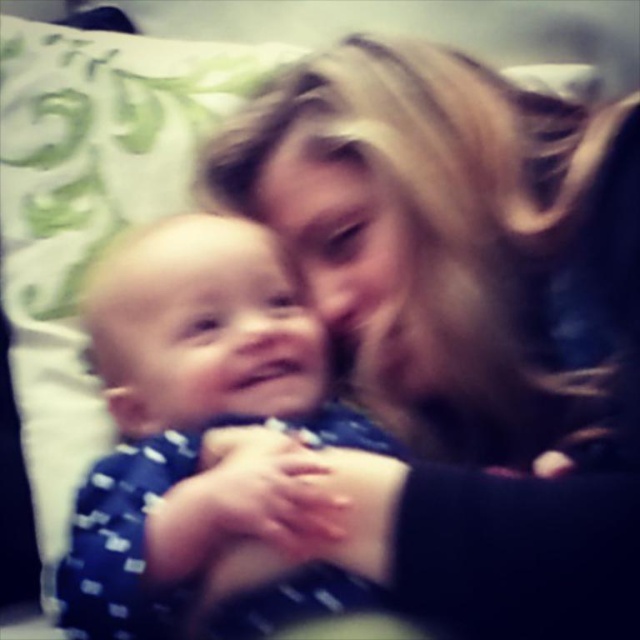
Looking at the scene, where is the blonde hair at upper center in relation to the blue dotted fabric at center?

The blonde hair at upper center is to the right of the blue dotted fabric at center.

Based on the photo, you are a photographer trying to capture the scene. You need to adjust the camera focus to ensure both the blonde hair at upper center and the blue dotted fabric at center are in focus. Which object should you focus on first to ensure depth of field covers both?

The blonde hair at upper center is taller than the blue dotted fabric at center. To ensure both are in focus, you should focus on the blonde hair at upper center first since it is farther away, allowing the depth of field to extend to the closer blue dotted fabric at center.

You are a photographer standing in front of the scene. You want to capture a closeup shot of the baby while ensuring the adult is still visible in the frame. Given your current distance, will the blonde hair at upper center be in focus if you focus on the baby?

The blonde hair at upper center is 17.74 inches away from the viewer. If you focus on the baby, the hair may be slightly out of focus since it is farther away than the baby, depending on the depth of field. Adjust your focus or distance to ensure both are sharp.